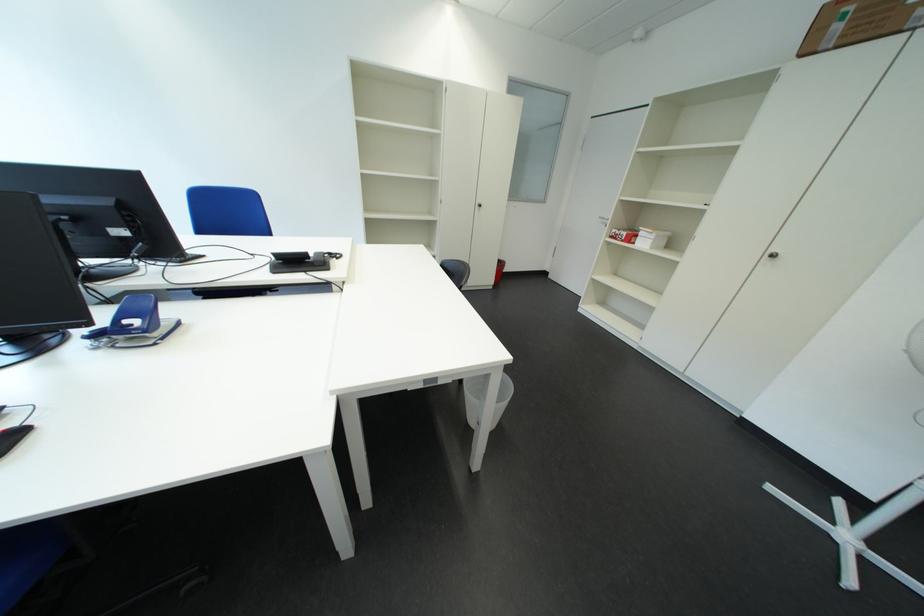
Find where to lift the red and white box. Please return your answer as a coordinate pair (x, y).

(624, 235)